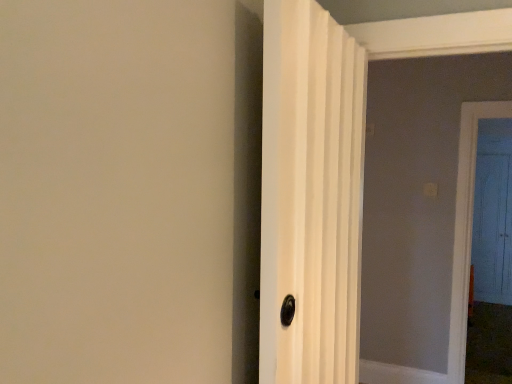
Question: Is white textured door at center, which ranks as the first door in left-to-right order, thinner than blue wooden door at right, marked as the first door in a back-to-front arrangement?

Choices:
 (A) no
 (B) yes

Answer: (A)

Question: Would you say white textured door at center, which ranks as the first door in front-to-back order, is a long distance from blue wooden door at right, which is counted as the 1th door, starting from the right?

Choices:
 (A) no
 (B) yes

Answer: (B)

Question: Does white textured door at center, positioned as the 2th door in right-to-left order, lie in front of blue wooden door at right, which is counted as the 1th door, starting from the right?

Choices:
 (A) no
 (B) yes

Answer: (B)

Question: From a real-world perspective, is white textured door at center, which ranks as the first door in left-to-right order, on blue wooden door at right, which is the second door in front-to-back order?

Choices:
 (A) yes
 (B) no

Answer: (A)

Question: Is white textured door at center, which ranks as the first door in front-to-back order, wider than blue wooden door at right, which is the second door in front-to-back order?

Choices:
 (A) yes
 (B) no

Answer: (A)

Question: Is blue wooden door at right, marked as the first door in a back-to-front arrangement, inside white textured door at center, which ranks as the first door in front-to-back order?

Choices:
 (A) no
 (B) yes

Answer: (A)

Question: Is blue wooden door at right, marked as the first door in a back-to-front arrangement, at the left side of white textured door at center, which ranks as the first door in left-to-right order?

Choices:
 (A) yes
 (B) no

Answer: (B)

Question: Does blue wooden door at right, which is counted as the 1th door, starting from the right, contain white textured door at center, which is the second door from back to front?

Choices:
 (A) yes
 (B) no

Answer: (B)

Question: From the image's perspective, is blue wooden door at right, which is the second door in front-to-back order, above white textured door at center, positioned as the 2th door in right-to-left order?

Choices:
 (A) yes
 (B) no

Answer: (B)

Question: Does blue wooden door at right, acting as the 2th door starting from the left, come behind white textured door at center, which is the second door from back to front?

Choices:
 (A) yes
 (B) no

Answer: (A)

Question: Is blue wooden door at right, acting as the 2th door starting from the left, completely or partially outside of white textured door at center, which is the second door from back to front?

Choices:
 (A) yes
 (B) no

Answer: (A)

Question: Is blue wooden door at right, acting as the 2th door starting from the left, aimed at white textured door at center, which is the second door from back to front?

Choices:
 (A) yes
 (B) no

Answer: (B)

Question: Would you say white textured door at center, which is the second door from back to front, is inside or outside blue wooden door at right, which is the second door in front-to-back order?

Choices:
 (A) outside
 (B) inside

Answer: (A)